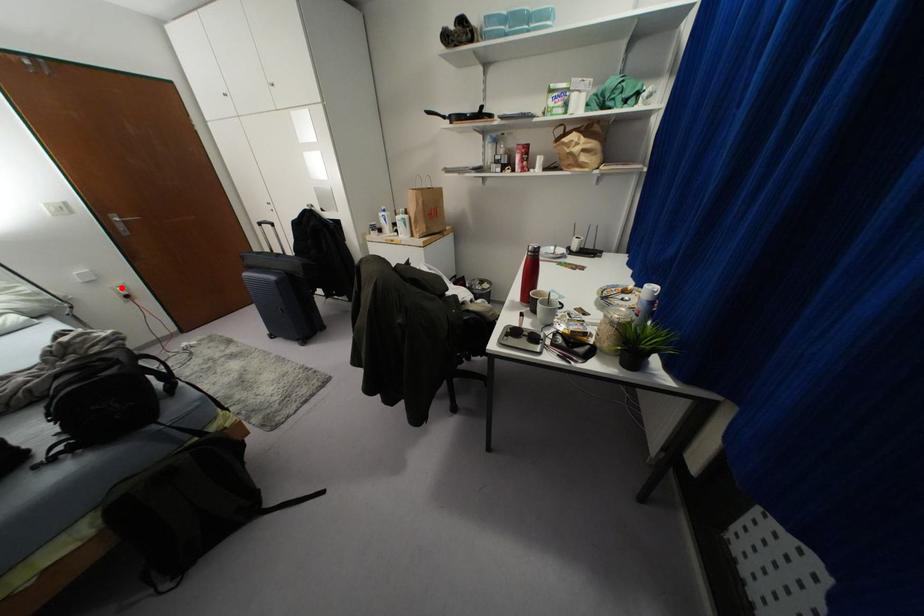
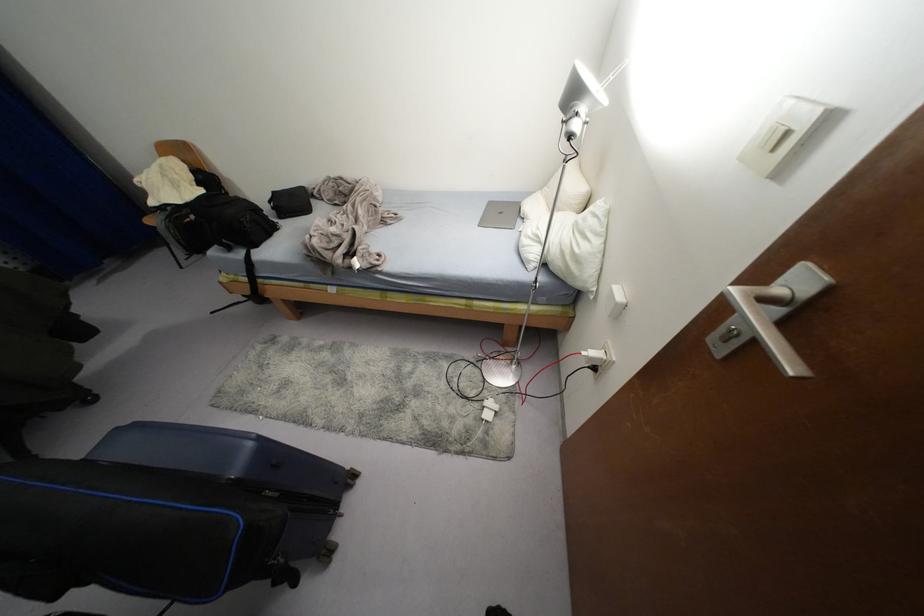
Question: I am providing you with two images of the same scene from different viewpoints. A red point is shown in image1. For the corresponding object point in image2, is it positioned nearer or farther from the camera?

Choices:
 (A) Nearer
 (B) Farther

Answer: (A)